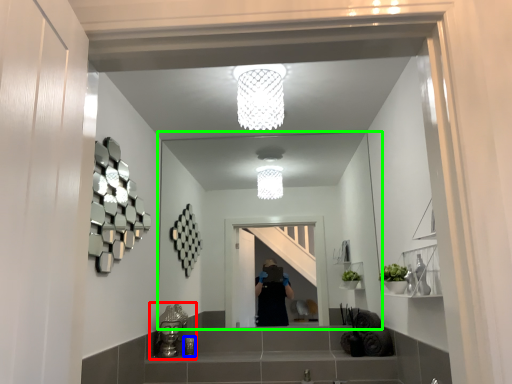
Question: Which is farther away from sink (highlighted by a red box)? toiletry (highlighted by a blue box) or mirror (highlighted by a green box)?

Choices:
 (A) toiletry
 (B) mirror

Answer: (B)